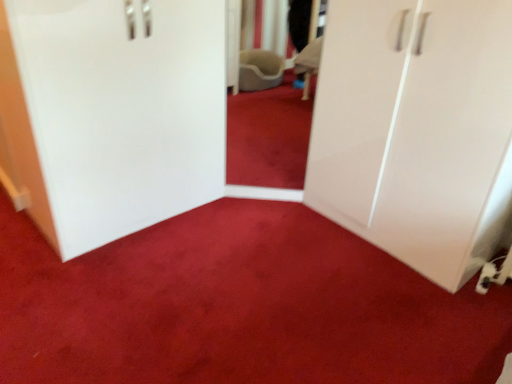
Question: From the image's perspective, is white glossy cabinet at left located above or below white glossy cupboard at right?

Choices:
 (A) above
 (B) below

Answer: (A)

Question: Looking at the image, does white glossy cabinet at left seem bigger or smaller compared to white glossy cupboard at right?

Choices:
 (A) big
 (B) small

Answer: (B)

Question: Based on their relative distances, which object is nearer to the matte white wardrobe at center?

Choices:
 (A) white glossy cabinet at left
 (B) white glossy cupboard at right

Answer: (B)

Question: Which of these objects is positioned closest to the white glossy cabinet at left?

Choices:
 (A) matte white wardrobe at center
 (B) white glossy cupboard at right

Answer: (A)